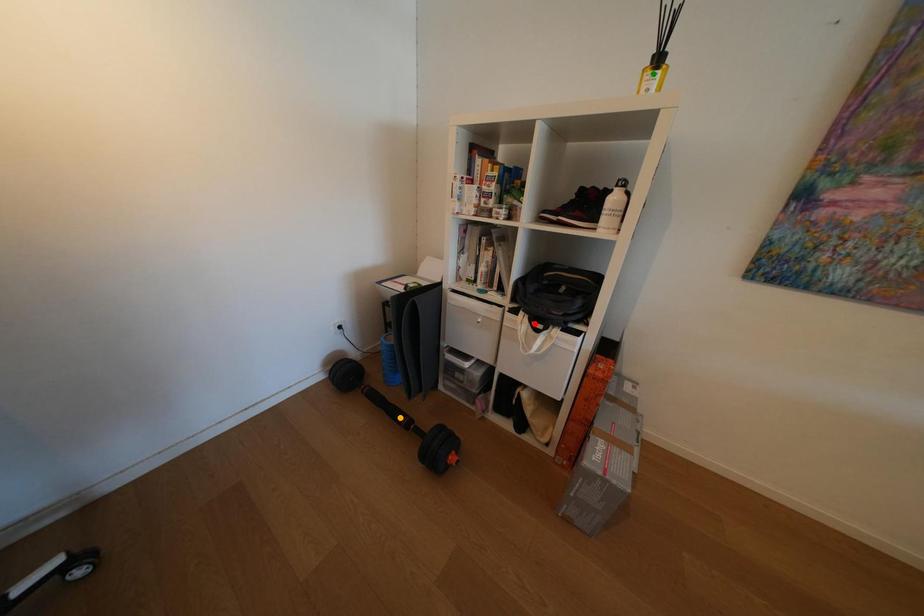
Order these from nearest to farthest:
red point, orange point, green point

green point → red point → orange point